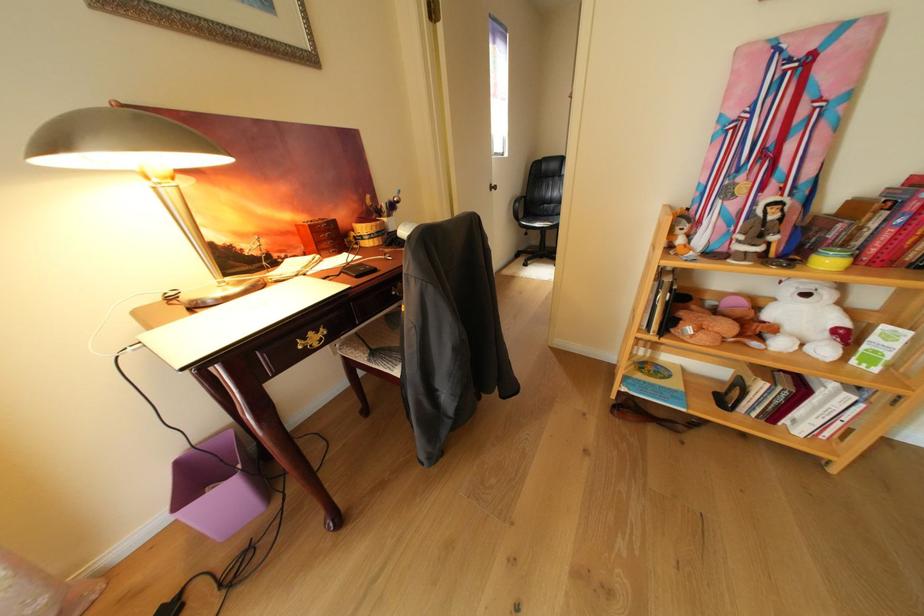
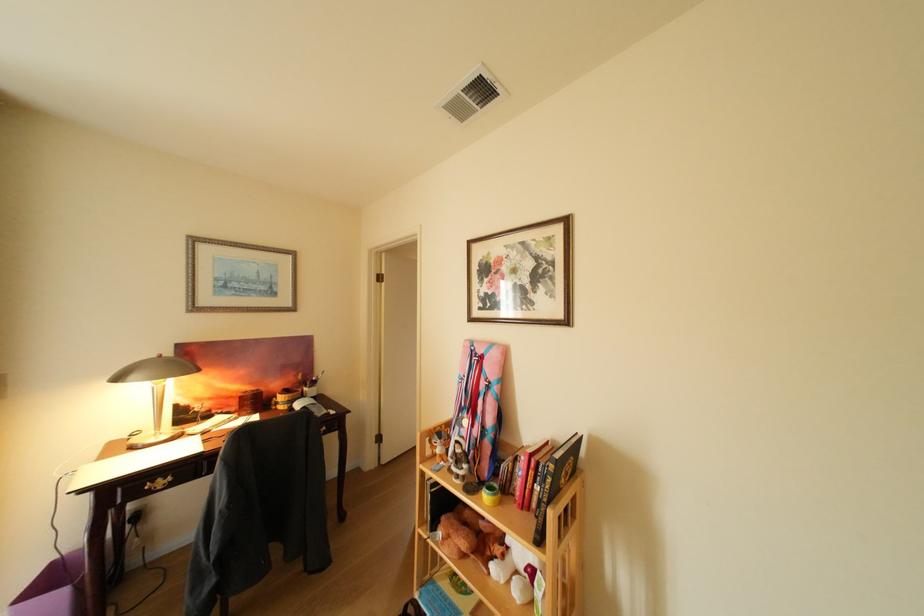
Find the pixel in the second image that matches the point at 302,219 in the first image.

(251, 389)